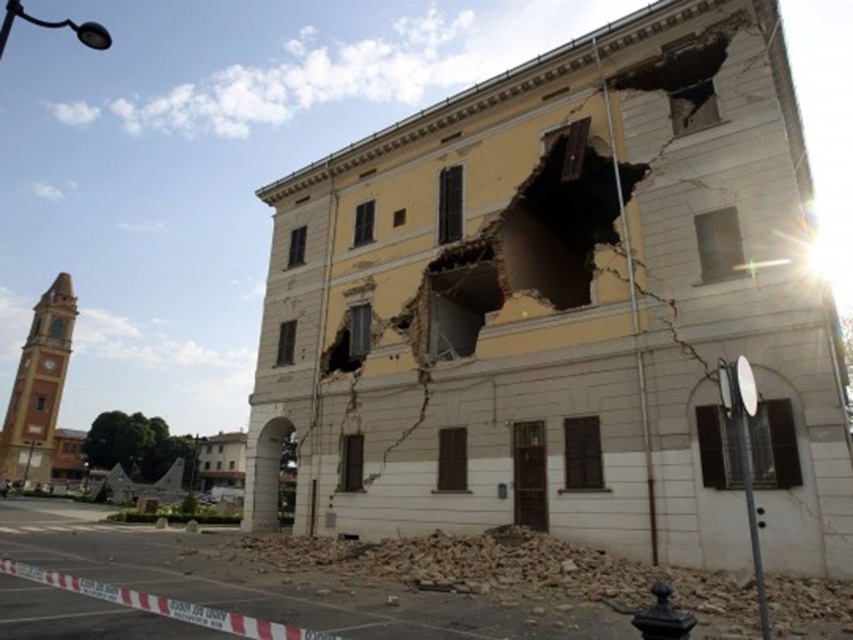
Question: Is yellow plaster wall at center to the right of broken concrete rubble at lower center from the viewer's perspective?

Choices:
 (A) yes
 (B) no

Answer: (A)

Question: In this image, where is yellow plaster wall at center located relative to broken concrete rubble at lower center?

Choices:
 (A) below
 (B) above

Answer: (B)

Question: Which point is farther to the camera?

Choices:
 (A) (622, 611)
 (B) (692, 410)

Answer: (B)

Question: From the image, what is the correct spatial relationship of yellow plaster wall at center in relation to broken concrete rubble at lower center?

Choices:
 (A) left
 (B) right

Answer: (B)

Question: Which point appears closest to the camera in this image?

Choices:
 (A) (599, 589)
 (B) (497, 364)

Answer: (A)